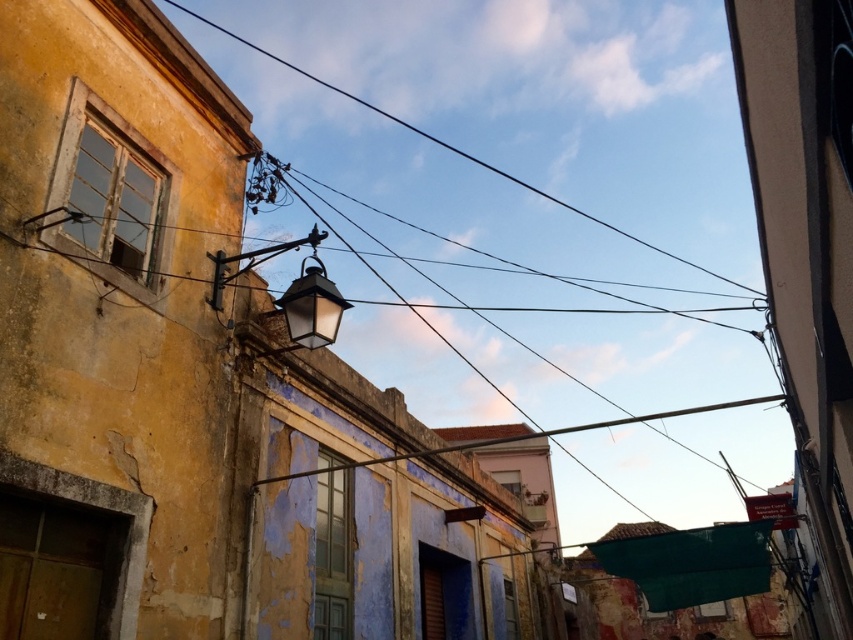
You are a delivery drone flying over the urban street scene. You need to land precisely at the black wire at upper center. According to the coordinates provided, what are the exact coordinates where you should aim to land?

The black wire at upper center is located at coordinates point (514, 125), so you should aim for those exact coordinates to land precisely.

You are a delivery person trying to navigate through the urban street scene. You need to deliver a package to the building on the left. The black wire at upper center is blocking your path. Can you move around it to reach the matte black lantern at center?

The matte black lantern at center is behind the black wire at upper center, so you can move around the black wire at upper center to reach the matte black lantern at center since it is positioned behind it.